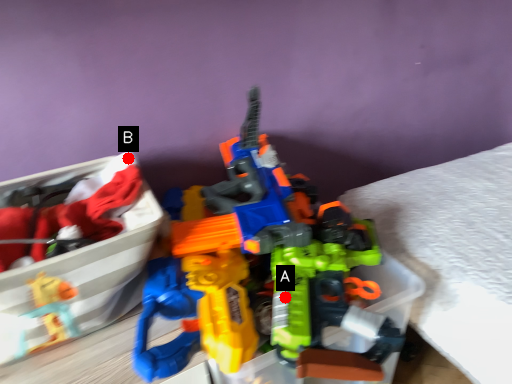
Question: Two points are circled on the image, labeled by A and B beside each circle. Which point appears farthest from the camera in this image?

Choices:
 (A) A is further
 (B) B is further

Answer: (B)